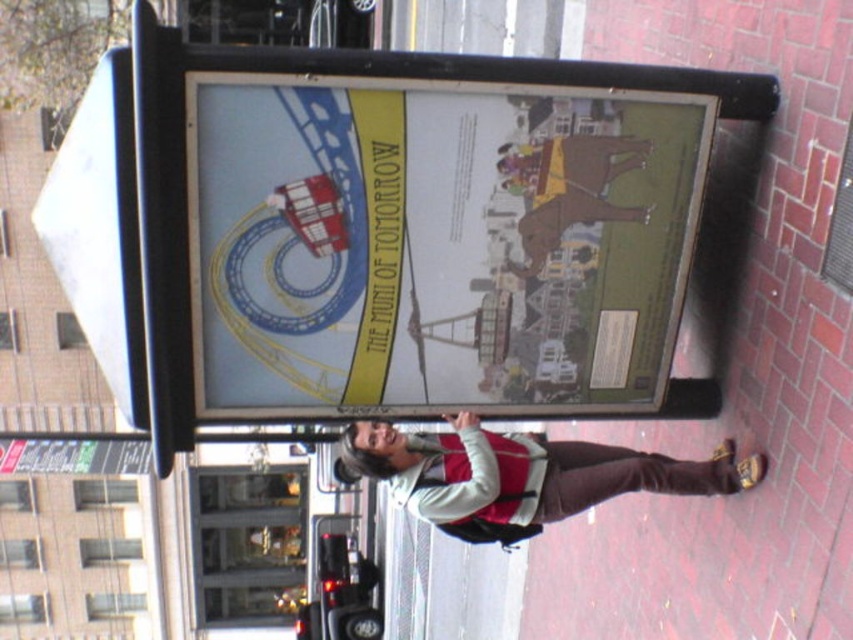
Question: Does matte paper poster at center have a smaller size compared to velvet-like brown pants at lower right?

Choices:
 (A) no
 (B) yes

Answer: (A)

Question: Which of the following is the farthest from the observer?

Choices:
 (A) (380, 451)
 (B) (641, 106)

Answer: (A)

Question: Among these objects, which one is nearest to the camera?

Choices:
 (A) velvet-like brown pants at lower right
 (B) matte paper poster at center

Answer: (B)

Question: Does matte paper poster at center have a greater width compared to velvet-like brown pants at lower right?

Choices:
 (A) no
 (B) yes

Answer: (B)

Question: Which point is farther to the camera?

Choices:
 (A) velvet-like brown pants at lower right
 (B) matte paper poster at center

Answer: (A)

Question: Can you confirm if matte paper poster at center is positioned above velvet-like brown pants at lower right?

Choices:
 (A) no
 (B) yes

Answer: (B)